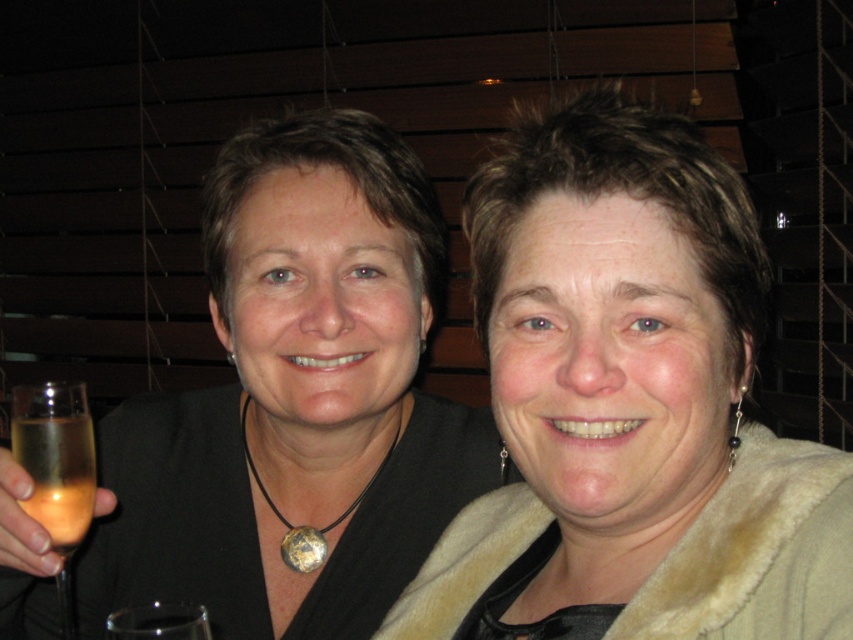
You are standing in front of the image and want to determine which of the two points, point (341, 580) or point (56, 508), is closer to you. Based on the scene description, which point is nearer?

Point (341, 580) is further to the viewer than point (56, 508), so the closer point to you is point (56, 508).

You are at a party and want to place your fuzzy beige coat at center and translucent glass at left on a narrow shelf. Which item should you place first to ensure both fit?

The fuzzy beige coat at center is wider than the translucent glass at left, so you should place the narrower translucent glass at left first to make space for the wider coat.

You are a photographer adjusting lighting for a portrait. You notice the matte black top at center and the translucent glass at left in the frame. Which object should you focus on to ensure proper exposure since it is taller?

The matte black top at center is taller than the translucent glass at left, so you should focus on the matte black top at center for proper exposure.